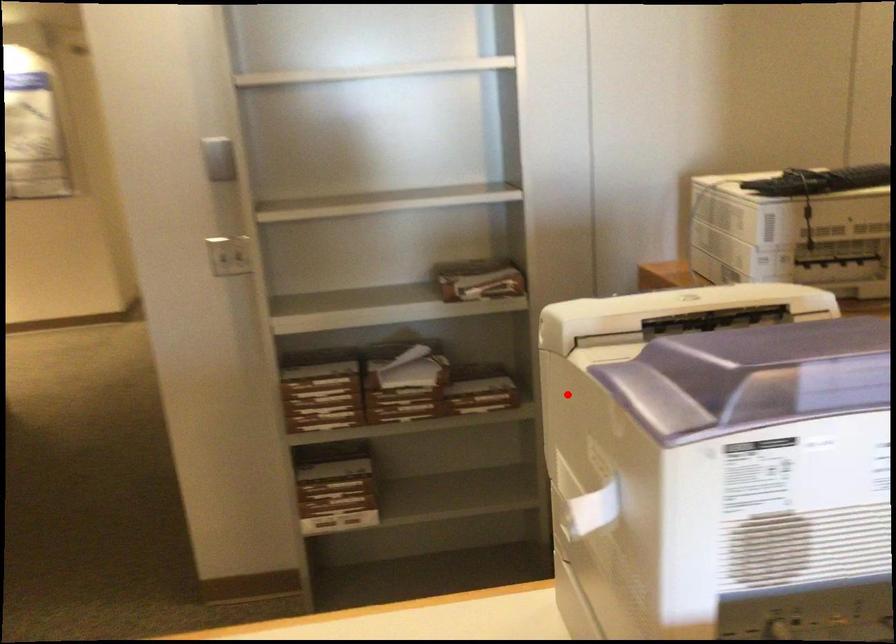
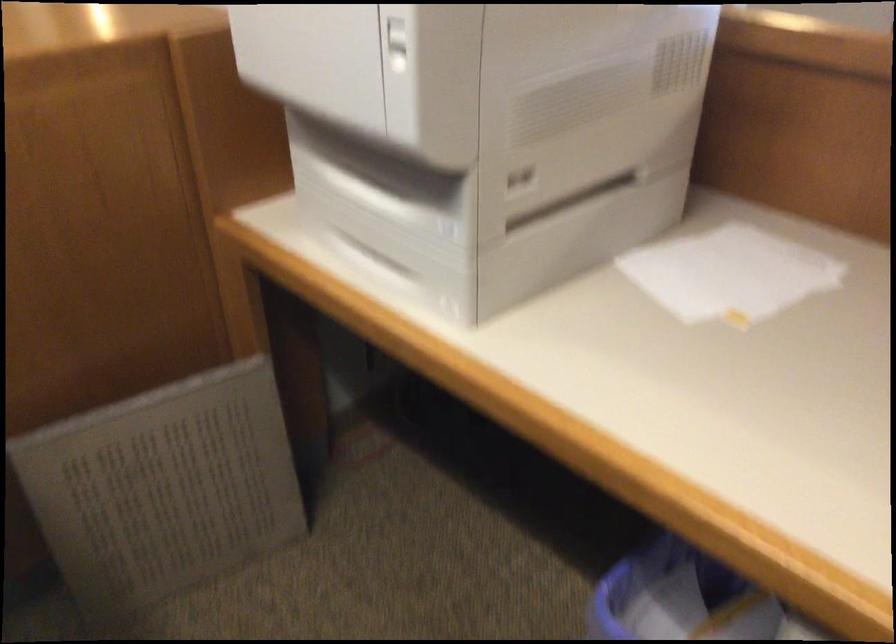
In the second image, find the point that corresponds to the highlighted location in the first image.

(397, 44)